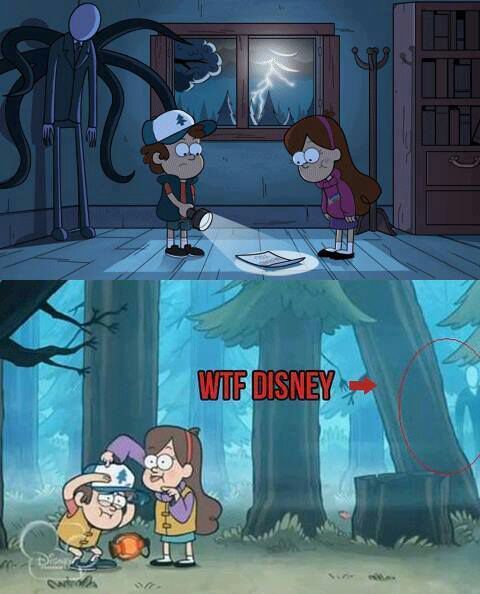
Find the location of a particular element. The width and height of the screenshot is (480, 594). windows is located at coordinates coord(201,81), coord(271,77).